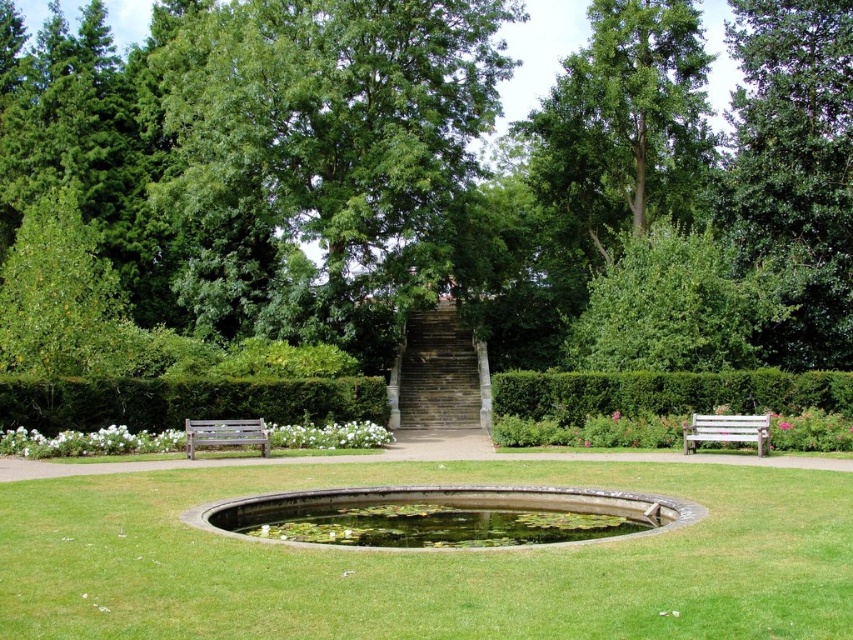
Can you confirm if green leafy tree at center is taller than clear glass water at center?

Correct, green leafy tree at center is much taller as clear glass water at center.

Is green leafy tree at center smaller than clear glass water at center?

No.

Locate an element on the screen. The width and height of the screenshot is (853, 640). green leafy tree at center is located at coordinates (450, 172).

At what (x,y) coordinates should I click in order to perform the action: click on green leafy tree at center. Please return your answer as a coordinate pair (x, y). This screenshot has width=853, height=640. Looking at the image, I should click on (450, 172).

Does green leafy bush at upper right have a larger size compared to white wooden bench at right?

Correct, green leafy bush at upper right is larger in size than white wooden bench at right.

Does green leafy bush at upper right appear on the right side of white wooden bench at right?

Yes, green leafy bush at upper right is to the right of white wooden bench at right.

Between point (657, 260) and point (735, 433), which one is positioned in front?

Positioned in front is point (735, 433).

Find the location of a particular element. The width and height of the screenshot is (853, 640). green leafy bush at upper right is located at coordinates (676, 307).

Between point (733, 504) and point (753, 220), which one is positioned behind?

The point (753, 220) is more distant.

Is green grassy at center shorter than green leafy tree at upper right?

Correct, green grassy at center is not as tall as green leafy tree at upper right.

Does point (503, 616) come in front of point (779, 232)?

Yes.

Where is `green grassy at center`? Image resolution: width=853 pixels, height=640 pixels. green grassy at center is located at coordinates point(426,561).